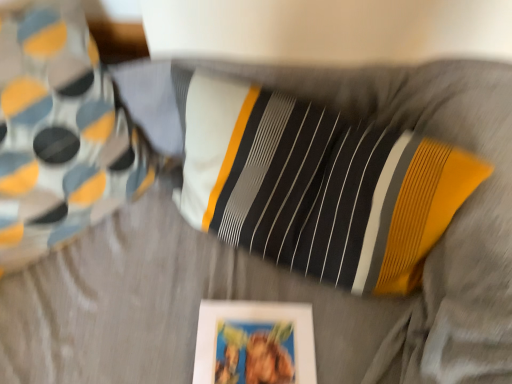
Question: Based on their sizes in the image, would you say matte white picture frame at lower center is bigger or smaller than striped fabric pillow at upper left?

Choices:
 (A) big
 (B) small

Answer: (B)

Question: Is matte white picture frame at lower center to the left or to the right of striped fabric pillow at upper left in the image?

Choices:
 (A) right
 (B) left

Answer: (A)

Question: Is matte white picture frame at lower center taller or shorter than striped fabric pillow at upper left?

Choices:
 (A) tall
 (B) short

Answer: (B)

Question: Is striped fabric pillow at upper left inside the boundaries of matte white picture frame at lower center, or outside?

Choices:
 (A) inside
 (B) outside

Answer: (B)

Question: From a real-world perspective, is striped fabric pillow at upper left positioned above or below matte white picture frame at lower center?

Choices:
 (A) below
 (B) above

Answer: (B)

Question: From the image's perspective, relative to matte white picture frame at lower center, is striped fabric pillow at upper left above or below?

Choices:
 (A) above
 (B) below

Answer: (A)

Question: Does point (0, 185) appear closer or farther from the camera than point (202, 370)?

Choices:
 (A) closer
 (B) farther

Answer: (B)